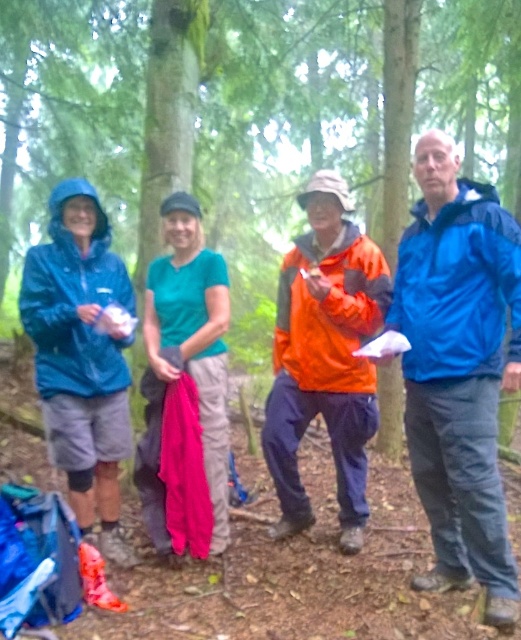
Does orange waterproof jacket at center appear on the left side of matte blue jacket at left?

In fact, orange waterproof jacket at center is to the right of matte blue jacket at left.

Is orange waterproof jacket at center closer to camera compared to matte blue jacket at left?

That is False.

Locate an element on the screen. The height and width of the screenshot is (640, 521). orange waterproof jacket at center is located at coordinates 325,356.

Can you confirm if green matte tree at center is taller than orange waterproof jacket at center?

Correct, green matte tree at center is much taller as orange waterproof jacket at center.

Does green matte tree at center come behind orange waterproof jacket at center?

Yes, it is behind orange waterproof jacket at center.

Does point (115, 100) come behind point (311, 353)?

Yes, it is.

You are a GUI agent. You are given a task and a screenshot of the screen. Output one action in this format:
    pyautogui.click(x=<x>, y=<y>)
    Task: Click on the green matte tree at center
    The image size is (521, 640).
    Given the screenshot: What is the action you would take?
    pyautogui.click(x=244, y=113)

Which is more to the left, blue smooth jacket at right or matte blue jacket at left?

matte blue jacket at left

Does blue smooth jacket at right have a greater height compared to matte blue jacket at left?

Yes, blue smooth jacket at right is taller than matte blue jacket at left.

Is point (510, 243) closer to camera compared to point (53, 304)?

That is True.

The width and height of the screenshot is (521, 640). I want to click on blue smooth jacket at right, so click(x=458, y=369).